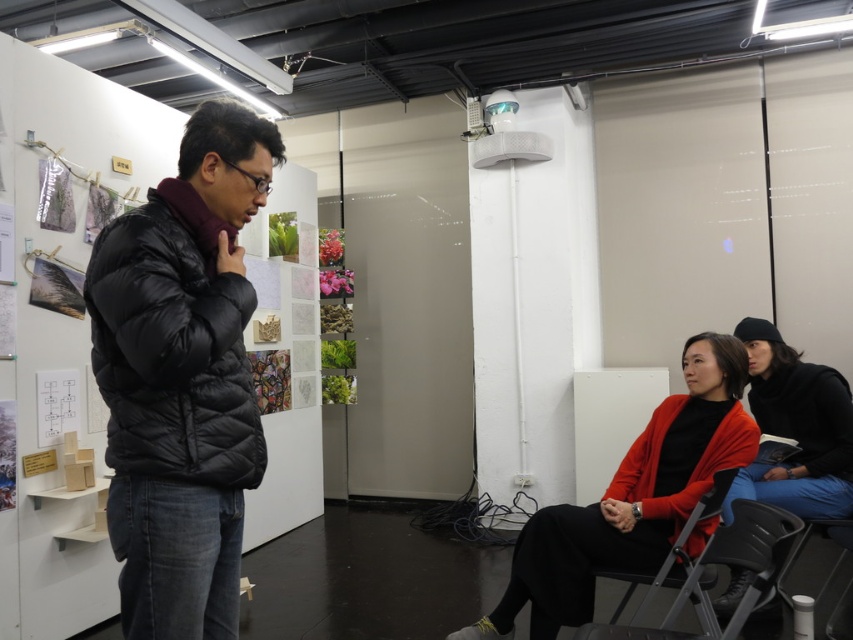
Question: From the image, what is the correct spatial relationship of matte black sweater at lower right in relation to black plastic chair at lower center?

Choices:
 (A) right
 (B) left

Answer: (A)

Question: Estimate the real-world distances between objects in this image. Which object is farther from the matte red sweater at lower right?

Choices:
 (A) matte black sweater at lower right
 (B) black plastic chair at lower center

Answer: (A)

Question: Is black puffer jacket at center further to camera compared to black plastic chair at lower center?

Choices:
 (A) yes
 (B) no

Answer: (B)

Question: Can you confirm if matte red sweater at lower right is wider than matte black sweater at lower right?

Choices:
 (A) yes
 (B) no

Answer: (A)

Question: Which point appears closest to the camera in this image?

Choices:
 (A) (193, 308)
 (B) (838, 499)
 (C) (712, 348)

Answer: (A)

Question: Which point is farther to the camera?

Choices:
 (A) (209, 388)
 (B) (674, 403)
 (C) (828, 488)
 (D) (692, 604)

Answer: (C)